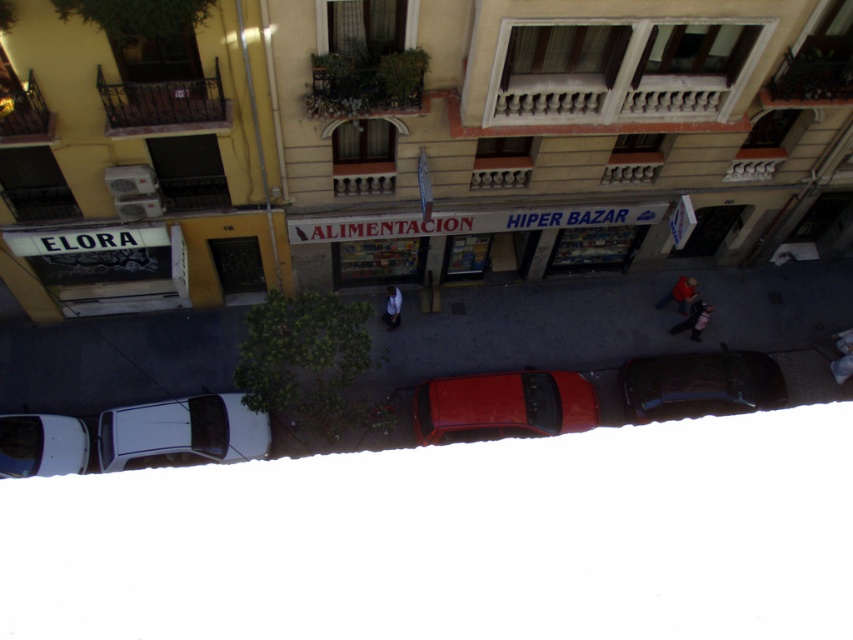
Between matte red helmet at center and light blue jeans at center, which one appears on the left side from the viewer's perspective?

light blue jeans at center

Does matte red helmet at center have a smaller size compared to light blue jeans at center?

Incorrect, matte red helmet at center is not smaller in size than light blue jeans at center.

Does point (693, 282) come behind point (387, 289)?

Yes, point (693, 282) is farther from viewer.

You are a GUI agent. You are given a task and a screenshot of the screen. Output one action in this format:
    pyautogui.click(x=<x>, y=<y>)
    Task: Click on the matte red helmet at center
    
    Given the screenshot: What is the action you would take?
    pyautogui.click(x=679, y=294)

Is shiny red car at center to the left of shiny black car at lower right from the viewer's perspective?

Indeed, shiny red car at center is positioned on the left side of shiny black car at lower right.

Is shiny red car at center above shiny black car at lower right?

No.

Locate an element on the screen. This screenshot has width=853, height=640. shiny red car at center is located at coordinates (502, 406).

This screenshot has height=640, width=853. What do you see at coordinates (694, 320) in the screenshot? I see `dark gray fabric jacket at lower right` at bounding box center [694, 320].

Is point (680, 326) behind point (670, 291)?

No.

I want to click on dark gray fabric jacket at lower right, so click(x=694, y=320).